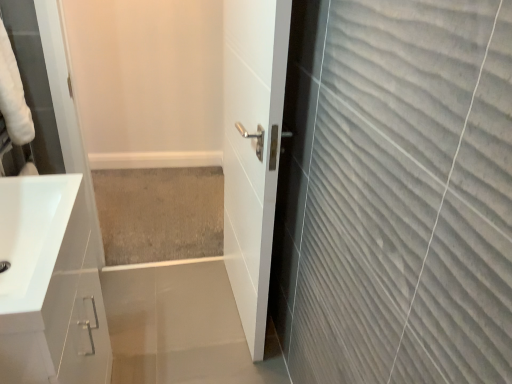
Describe the element at coordinates (161, 212) in the screenshot. This screenshot has height=384, width=512. I see `beige carpet at center` at that location.

Looking at this image, what is the approximate height of white glossy sink at lower left?

It is 11.13 inches.

Where is `white glossy sink at lower left`? white glossy sink at lower left is located at coordinates (32, 235).

I want to click on beige carpet at center, so click(161, 212).

From the image's perspective, which is below, white glossy door at center or white glossy sink at lower left?

white glossy sink at lower left is shown below in the image.

Is the position of white glossy door at center less distant than that of white glossy sink at lower left?

No, white glossy door at center is behind white glossy sink at lower left.

Is white glossy door at center turned away from white glossy sink at lower left?

No, white glossy door at center's orientation is not away from white glossy sink at lower left.

At what (x,y) coordinates should I click in order to perform the action: click on door below the white glossy sink at lower left (from a real-world perspective). Please return your answer as a coordinate pair (x, y). The height and width of the screenshot is (384, 512). Looking at the image, I should click on (252, 150).

From a real-world perspective, which object stands above the other?

From a 3D spatial view, white glossy door at center is above.

Is point (269, 191) closer or farther from the camera than point (195, 207)?

Clearly, point (269, 191) is closer to the camera than point (195, 207).

The width and height of the screenshot is (512, 384). Find the location of `bath on the left of white glossy door at center`. bath on the left of white glossy door at center is located at coordinates (161, 212).

Between white glossy door at center and beige carpet at center, which one appears on the right side from the viewer's perspective?

white glossy door at center.

Can you confirm if beige carpet at center is positioned to the left of white glossy door at center?

Correct, you'll find beige carpet at center to the left of white glossy door at center.

Does beige carpet at center have a greater height compared to white glossy door at center?

Incorrect, the height of beige carpet at center is not larger of that of white glossy door at center.

Considering the sizes of objects white glossy sink at lower left and beige carpet at center in the image provided, who is thinner, white glossy sink at lower left or beige carpet at center?

Thinner between the two is white glossy sink at lower left.

In the scene shown: Is white glossy sink at lower left turned away from beige carpet at center?

white glossy sink at lower left is not turned away from beige carpet at center.

Considering the positions of points (44, 198) and (138, 261), is point (44, 198) farther from camera compared to point (138, 261)?

That is False.

From the image's perspective, between white glossy sink at lower left and beige carpet at center, which one is located above?

beige carpet at center.

Is beige carpet at center far from white glossy sink at lower left?

Yes, beige carpet at center is far from white glossy sink at lower left.

Does beige carpet at center have a greater height compared to white glossy sink at lower left?

In fact, beige carpet at center may be shorter than white glossy sink at lower left.

Find the location of a particular element. This screenshot has width=512, height=384. sink above the beige carpet at center (from a real-world perspective) is located at coordinates (32, 235).

Does point (162, 230) appear closer or farther from the camera than point (6, 289)?

Point (162, 230) is farther from the camera than point (6, 289).

Which object is positioned more to the left, white glossy sink at lower left or white glossy door at center?

Positioned to the left is white glossy sink at lower left.

Which object is closer to the camera, white glossy sink at lower left or white glossy door at center?

white glossy sink at lower left is more forward.

Could you tell me if white glossy sink at lower left is facing white glossy door at center?

Yes.

Is white glossy sink at lower left taller than white glossy door at center?

Incorrect, the height of white glossy sink at lower left is not larger of that of white glossy door at center.

In order to click on sink in front of the white glossy door at center in this screenshot , I will do `click(32, 235)`.

The width and height of the screenshot is (512, 384). I want to click on door above the beige carpet at center (from the image's perspective), so click(x=252, y=150).

When comparing their distances from white glossy door at center, does beige carpet at center or white glossy sink at lower left seem further?

The object further to white glossy door at center is beige carpet at center.

From the image, which object appears to be nearer to white glossy sink at lower left, white glossy door at center or beige carpet at center?

Among the two, white glossy door at center is located nearer to white glossy sink at lower left.

Which object lies further to the anchor point beige carpet at center, white glossy door at center or white glossy sink at lower left?

white glossy sink at lower left is further to beige carpet at center.

Based on their spatial positions, is beige carpet at center or white glossy door at center further from white glossy sink at lower left?

Among the two, beige carpet at center is located further to white glossy sink at lower left.

Considering their positions, is white glossy sink at lower left positioned further to white glossy door at center than beige carpet at center?

beige carpet at center is positioned further to the anchor white glossy door at center.

From the image, which object appears to be nearer to beige carpet at center, white glossy sink at lower left or white glossy door at center?

white glossy door at center lies closer to beige carpet at center than the other object.

At what (x,y) coordinates should I click in order to perform the action: click on door between white glossy sink at lower left and beige carpet at center from front to back. Please return your answer as a coordinate pair (x, y). Looking at the image, I should click on (252, 150).